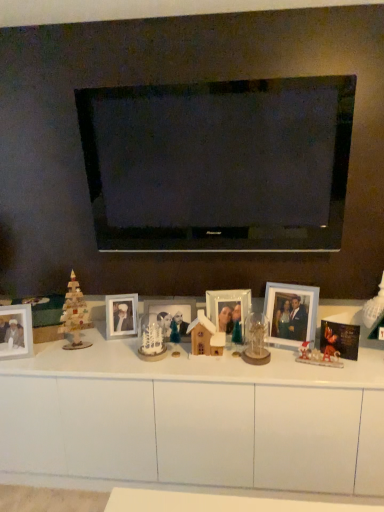
Locate an element on the screen. free location to the right of white frosted glass christmas tree at center, which ranks as the 3th toy in right-to-left order is located at coordinates (184, 355).